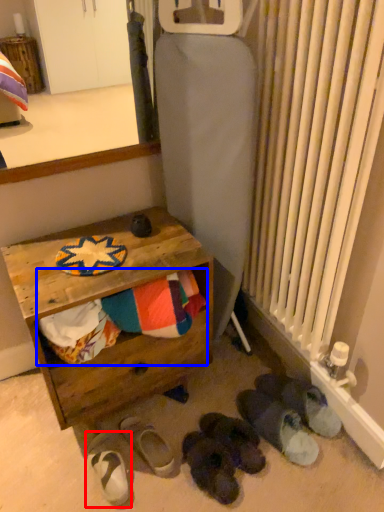
Question: Which point is closer to the camera, footwear (highlighted by a red box) or laundry (highlighted by a blue box)?

Choices:
 (A) footwear
 (B) laundry

Answer: (B)